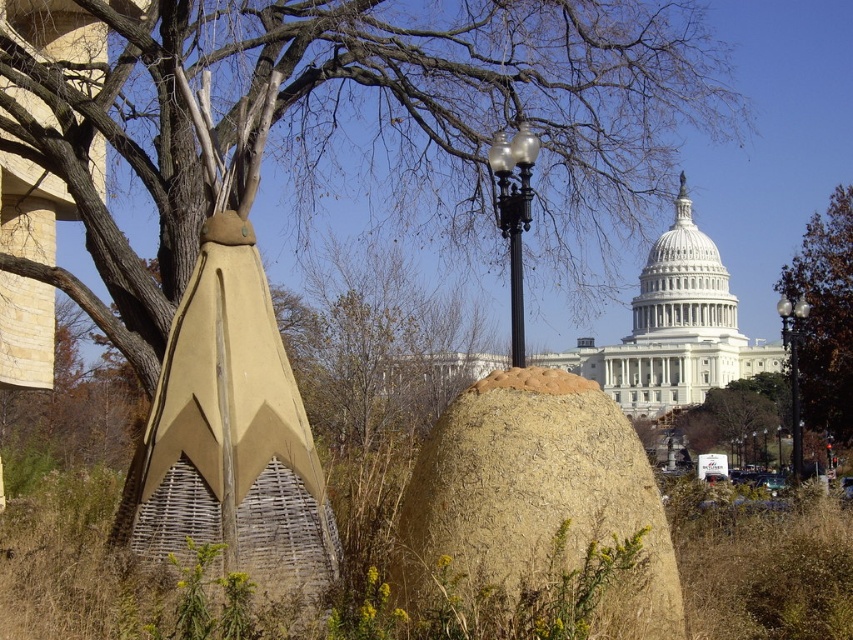
Question: Is brown textured mound at center below brown textured tree at upper right?

Choices:
 (A) no
 (B) yes

Answer: (B)

Question: Which of the following is the farthest from the observer?

Choices:
 (A) tan wicker sculpture at left
 (B) metallic pole at center
 (C) glass globe streetlight at center

Answer: (B)

Question: Based on their relative distances, which object is nearer to the brown textured mound at center?

Choices:
 (A) glass globe streetlight at center
 (B) tan wicker sculpture at left

Answer: (B)

Question: Does tan wicker sculpture at left appear on the right side of brown textured tree at upper right?

Choices:
 (A) no
 (B) yes

Answer: (A)

Question: Which point is farther to the camera?

Choices:
 (A) brown textured mound at center
 (B) brown textured tree at upper right
 (C) black metal streetlight at center

Answer: (B)

Question: Can you confirm if black metal streetlight at center is wider than glass globe streetlight at center?

Choices:
 (A) yes
 (B) no

Answer: (B)